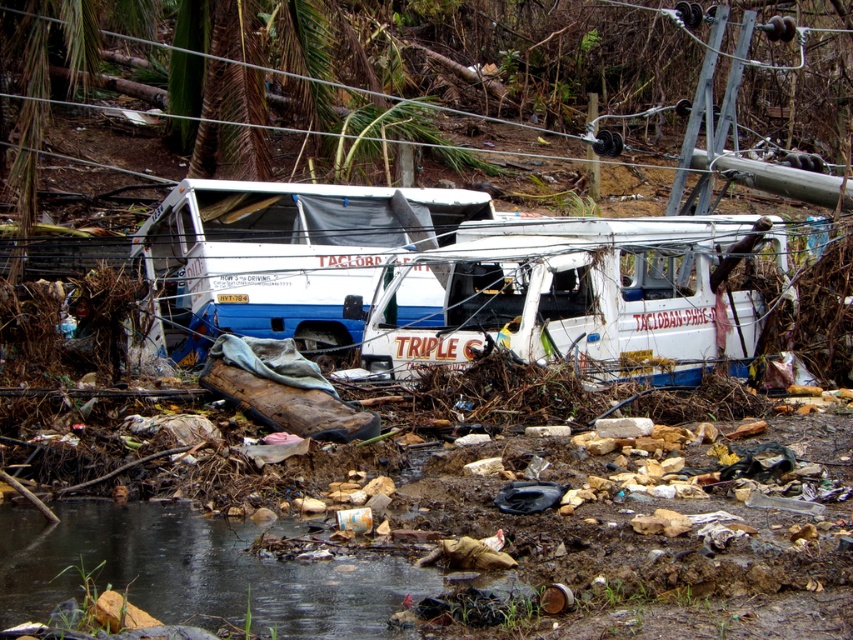
Question: From the image, what is the correct spatial relationship of white matte van at center in relation to translucent murky water at lower center?

Choices:
 (A) below
 (B) above

Answer: (B)

Question: Is white matte van at center to the right of translucent murky water at lower center from the viewer's perspective?

Choices:
 (A) yes
 (B) no

Answer: (A)

Question: Is the position of white matte van at center more distant than that of translucent murky water at lower center?

Choices:
 (A) yes
 (B) no

Answer: (A)

Question: Which point is closer to the camera?

Choices:
 (A) translucent murky water at lower center
 (B) white matte van at center

Answer: (A)